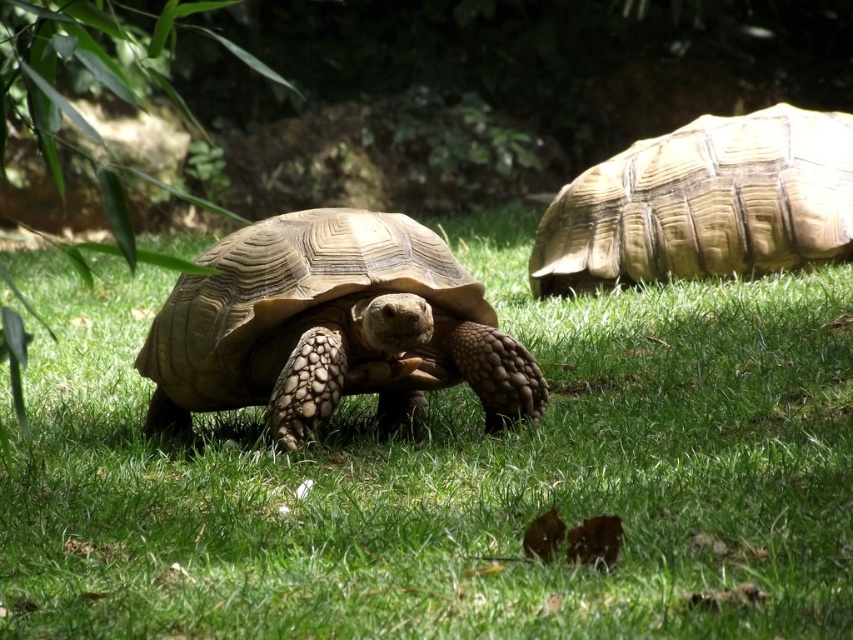
Looking at this image, which is more to the left, green grass at center or leather-like brown tortoise at center?

Positioned to the left is leather-like brown tortoise at center.

Is green grass at center positioned before leather-like brown tortoise at center?

Yes, it is in front of leather-like brown tortoise at center.

Does point (740, 477) lie in front of point (543, 390)?

Yes, it is.

Where is `green grass at center`? green grass at center is located at coordinates (451, 476).

Which is below, green grass at center or light brown textured shell at right?

green grass at center is below.

Is green grass at center to the left of light brown textured shell at right from the viewer's perspective?

Indeed, green grass at center is positioned on the left side of light brown textured shell at right.

Who is more distant from viewer, (344, 598) or (781, 262)?

The point (781, 262) is behind.

Where is `green grass at center`? The width and height of the screenshot is (853, 640). green grass at center is located at coordinates (451, 476).

Between leather-like brown tortoise at center and light brown textured shell at right, which one appears on the right side from the viewer's perspective?

light brown textured shell at right

Identify the location of leather-like brown tortoise at center. (331, 326).

Where is `leather-like brown tortoise at center`? This screenshot has width=853, height=640. leather-like brown tortoise at center is located at coordinates (331, 326).

Identify the location of leather-like brown tortoise at center. This screenshot has height=640, width=853. (331, 326).